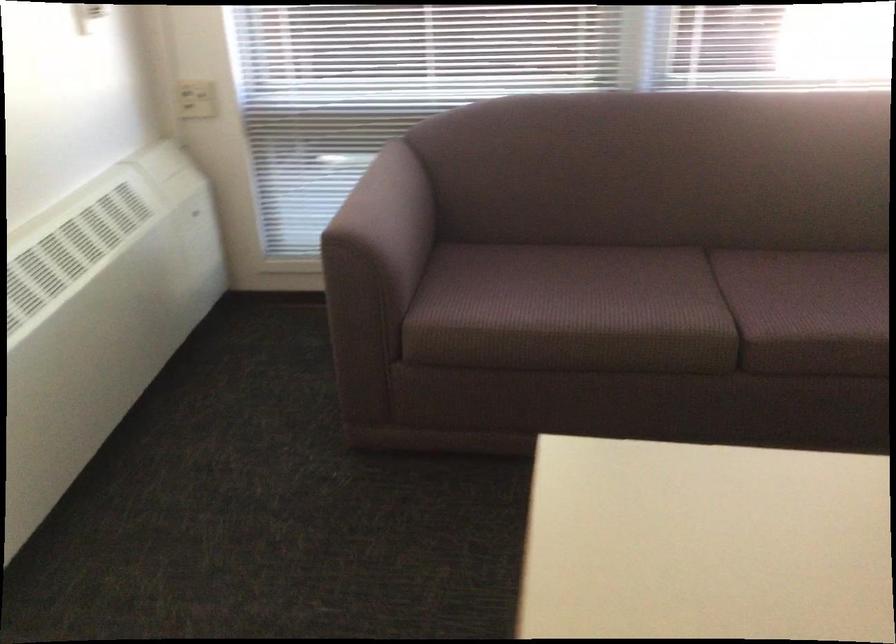
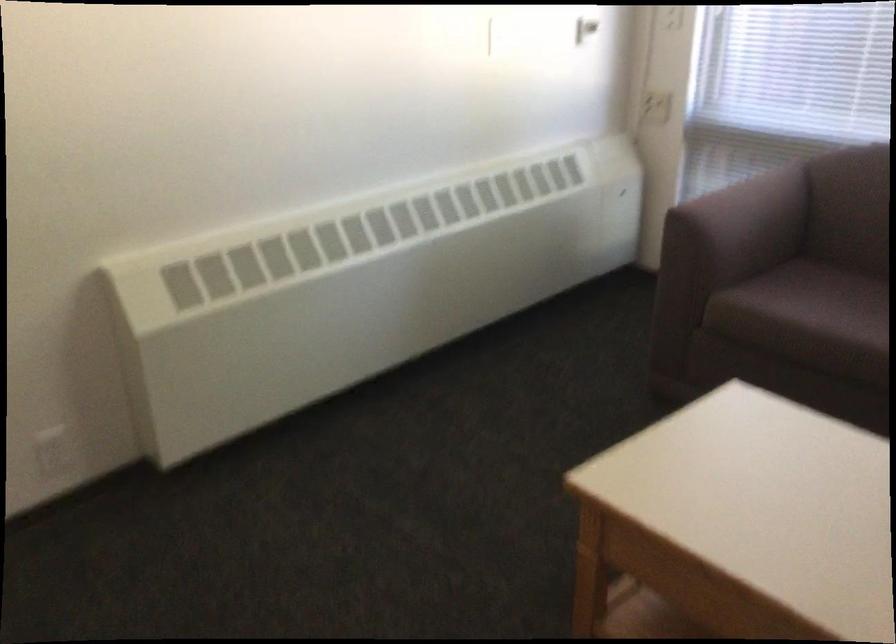
Locate, in the second image, the point that corresponds to point 395,205 in the first image.

(752, 207)